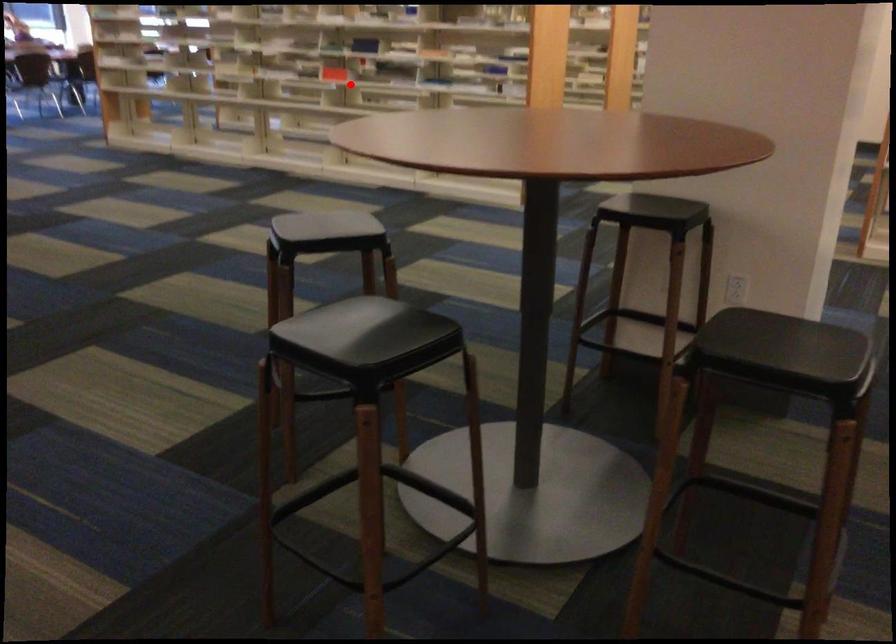
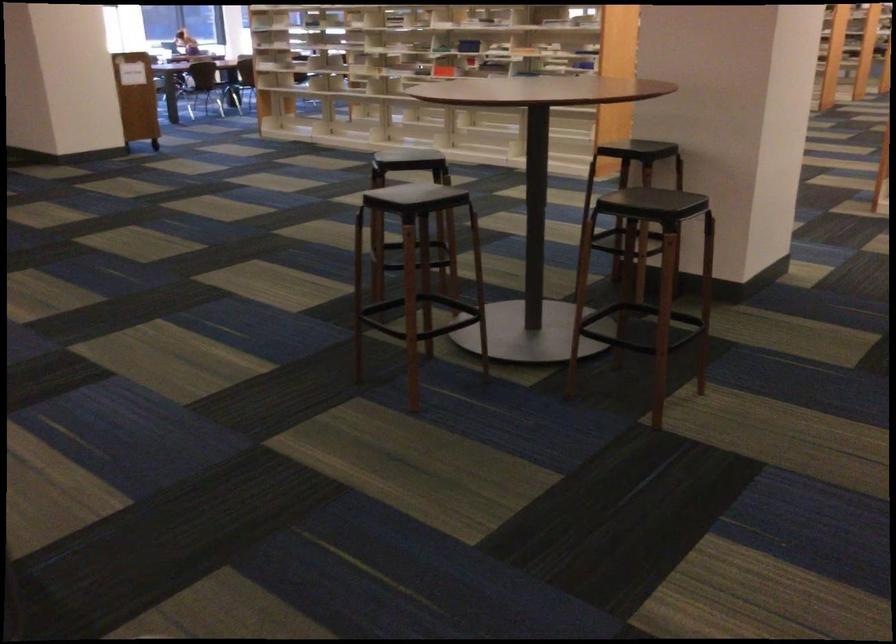
Where in the second image is the point corresponding to the highlighted location from the first image?

(443, 71)